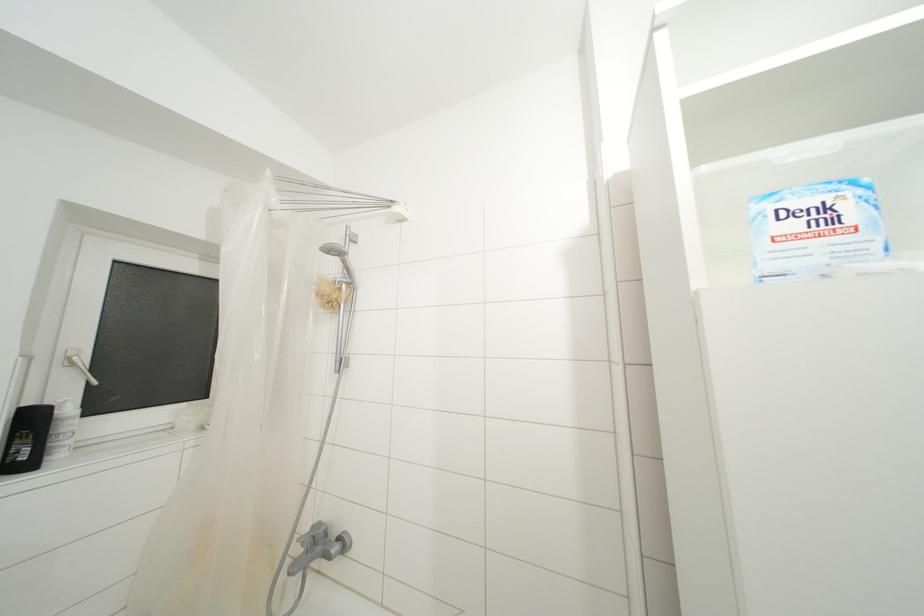
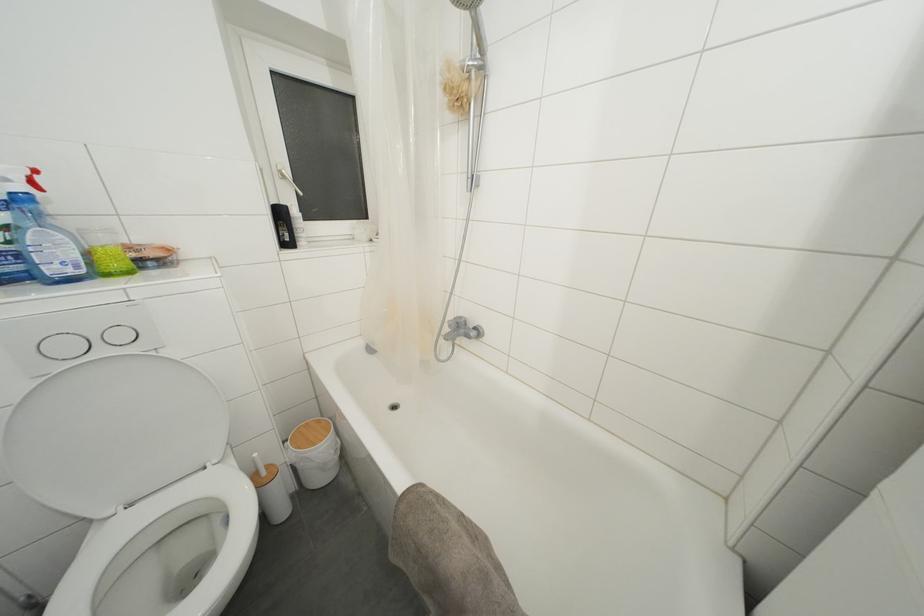
The point at (x=308, y=533) is marked in the first image. Where is the corresponding point in the second image?

(455, 321)